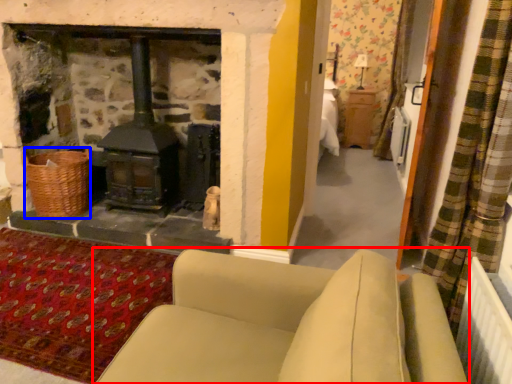
Question: Among these objects, which one is nearest to the camera, studio couch (highlighted by a red box) or basket (highlighted by a blue box)?

Choices:
 (A) studio couch
 (B) basket

Answer: (A)